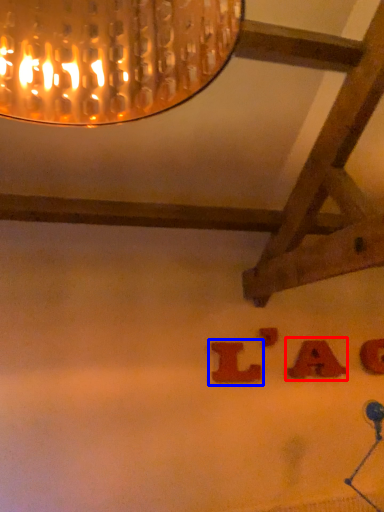
Question: Among these objects, which one is nearest to the camera, alphabet (highlighted by a red box) or alphabet (highlighted by a blue box)?

Choices:
 (A) alphabet
 (B) alphabet

Answer: (B)